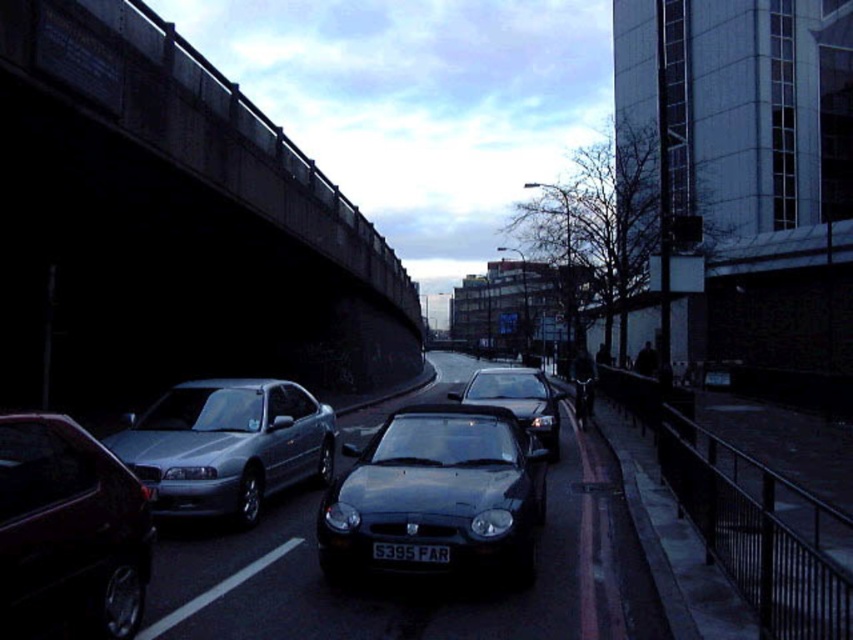
Can you confirm if concrete bridge at upper left is bigger than satin silver sedan at center?

Yes.

Between point (329, 276) and point (190, 477), which one is positioned in front?

Point (190, 477)

Locate an element on the screen. concrete bridge at upper left is located at coordinates (171, 225).

Does point (115, 452) lie in front of point (500, 406)?

Yes, point (115, 452) is closer to viewer.

Can you confirm if satin silver sedan at center is positioned above shiny black car at center?

Indeed, satin silver sedan at center is positioned over shiny black car at center.

This screenshot has height=640, width=853. I want to click on satin silver sedan at center, so click(227, 445).

Does point (277, 212) come in front of point (413, 545)?

That is False.

Which is in front, point (21, 208) or point (392, 554)?

Point (392, 554)

Which is behind, point (276, 257) or point (396, 552)?

Positioned behind is point (276, 257).

This screenshot has height=640, width=853. Identify the location of concrete bridge at upper left. (171, 225).